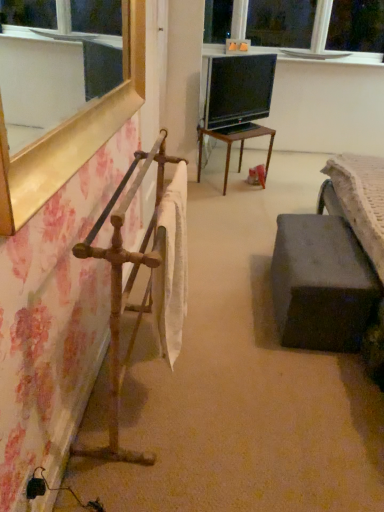
What do you see at coordinates (127, 288) in the screenshot?
I see `rusty metal towel rack at left` at bounding box center [127, 288].

At what (x,y) coordinates should I click in order to perform the action: click on black glossy tv at center. Please return your answer as a coordinate pair (x, y). The width and height of the screenshot is (384, 512). Looking at the image, I should click on (238, 90).

In the scene shown: Which object is further away from the camera taking this photo, rusty metal towel rack at left or wooden table at center?

wooden table at center is behind.

Is rusty metal towel rack at left facing away from wooden table at center?

rusty metal towel rack at left is not turned away from wooden table at center.

Is rusty metal towel rack at left wider or thinner than wooden table at center?

rusty metal towel rack at left is thinner than wooden table at center.

Is white glossy window sill at upper center inside wooden table at center?

No.

Is the depth of wooden table at center greater than that of white glossy window sill at upper center?

No.

Who is taller, wooden table at center or white glossy window sill at upper center?

Standing taller between the two is wooden table at center.

Considering the relative sizes of black glossy tv at center and rusty metal towel rack at left in the image provided, is black glossy tv at center shorter than rusty metal towel rack at left?

Yes.

Does black glossy tv at center appear on the right side of rusty metal towel rack at left?

Correct, you'll find black glossy tv at center to the right of rusty metal towel rack at left.

Which is nearer, (263,82) or (120,372)?

Point (263,82) is positioned farther from the camera compared to point (120,372).

Find the location of a particular element. television above the rusty metal towel rack at left (from a real-world perspective) is located at coordinates (238, 90).

Is wooden table at center positioned with its back to matte gray ottoman at center?

wooden table at center does not have its back to matte gray ottoman at center.

Which object is closer to the camera taking this photo, wooden table at center or matte gray ottoman at center?

matte gray ottoman at center is more forward.

Which of these two, wooden table at center or matte gray ottoman at center, is bigger?

With larger size is matte gray ottoman at center.

Measure the distance from wooden table at center to matte gray ottoman at center.

The distance of wooden table at center from matte gray ottoman at center is 1.71 meters.

Considering the relative sizes of white glossy window sill at upper center and wooden table at center in the image provided, is white glossy window sill at upper center smaller than wooden table at center?

Yes, white glossy window sill at upper center is smaller than wooden table at center.

From a real-world perspective, is white glossy window sill at upper center positioned over wooden table at center based on gravity?

Yes, from a real-world perspective, white glossy window sill at upper center is above wooden table at center.

Considering the sizes of white glossy window sill at upper center and wooden table at center in the image, is white glossy window sill at upper center taller or shorter than wooden table at center?

In the image, white glossy window sill at upper center appears to be shorter than wooden table at center.

Is white glossy window sill at upper center looking in the opposite direction of wooden table at center?

No, white glossy window sill at upper center's orientation is not away from wooden table at center.

Is white glossy window sill at upper center thinner than rusty metal towel rack at left?

Yes, white glossy window sill at upper center is thinner than rusty metal towel rack at left.

Between white glossy window sill at upper center and rusty metal towel rack at left, which one has smaller size?

white glossy window sill at upper center.

Is white glossy window sill at upper center oriented towards rusty metal towel rack at left?

No, white glossy window sill at upper center is not oriented towards rusty metal towel rack at left.

Based on the photo, is white glossy window sill at upper center far from rusty metal towel rack at left?

white glossy window sill at upper center is positioned a significant distance from rusty metal towel rack at left.

Considering the points (265, 87) and (219, 48), which point is behind, point (265, 87) or point (219, 48)?

The point (219, 48) is farther from the camera.

Can you tell me how much black glossy tv at center and white glossy window sill at upper center differ in facing direction?

There is a 47-degree angle between the facing directions of black glossy tv at center and white glossy window sill at upper center.

Could white glossy window sill at upper center be considered to be inside black glossy tv at center?

No, black glossy tv at center does not contain white glossy window sill at upper center.

Are black glossy tv at center and white glossy window sill at upper center far apart?

Yes.

At what (x,y) coordinates should I click in order to perform the action: click on rail above the wooden table at center (from a real-world perspective). Please return your answer as a coordinate pair (x, y). Looking at the image, I should click on (127, 288).

Locate an element on the screen. table in front of the white glossy window sill at upper center is located at coordinates (233, 142).

Based on their spatial positions, is black glossy tv at center or rusty metal towel rack at left further from white glossy window sill at upper center?

rusty metal towel rack at left lies further to white glossy window sill at upper center than the other object.

When comparing their distances from rusty metal towel rack at left, does matte gray ottoman at center or wooden table at center seem closer?

Among the two, matte gray ottoman at center is located nearer to rusty metal towel rack at left.

Based on their spatial positions, is rusty metal towel rack at left or white glossy window sill at upper center closer to matte gray ottoman at center?

The object closer to matte gray ottoman at center is rusty metal towel rack at left.

Looking at the image, which one is located closer to matte gray ottoman at center, white glossy window sill at upper center or wooden table at center?

wooden table at center is closer to matte gray ottoman at center.

From the picture: Looking at the image, which one is located closer to white glossy window sill at upper center, wooden table at center or matte gray ottoman at center?

wooden table at center.

Looking at this image, from the image, which object appears to be nearer to rusty metal towel rack at left, white glossy window sill at upper center or matte gray ottoman at center?

matte gray ottoman at center is closer to rusty metal towel rack at left.

Which object lies further to the anchor point rusty metal towel rack at left, matte gray ottoman at center or black glossy tv at center?

The object further to rusty metal towel rack at left is black glossy tv at center.

Looking at the image, which one is located closer to wooden table at center, rusty metal towel rack at left or black glossy tv at center?

Among the two, black glossy tv at center is located nearer to wooden table at center.

The height and width of the screenshot is (512, 384). I want to click on table between matte gray ottoman at center and white glossy window sill at upper center in the front-back direction, so click(x=233, y=142).

Where is `furniture located between rusty metal towel rack at left and wooden table at center in the depth direction`? furniture located between rusty metal towel rack at left and wooden table at center in the depth direction is located at coordinates (321, 284).

You are a GUI agent. You are given a task and a screenshot of the screen. Output one action in this format:
    pyautogui.click(x=<x>, y=<y>)
    Task: Click on the furniture located between rusty metal towel rack at left and black glossy tv at center in the depth direction
    
    Given the screenshot: What is the action you would take?
    pyautogui.click(x=321, y=284)

Where is `furniture located between rusty metal towel rack at left and white glossy window sill at upper center in the depth direction`? furniture located between rusty metal towel rack at left and white glossy window sill at upper center in the depth direction is located at coordinates (321, 284).